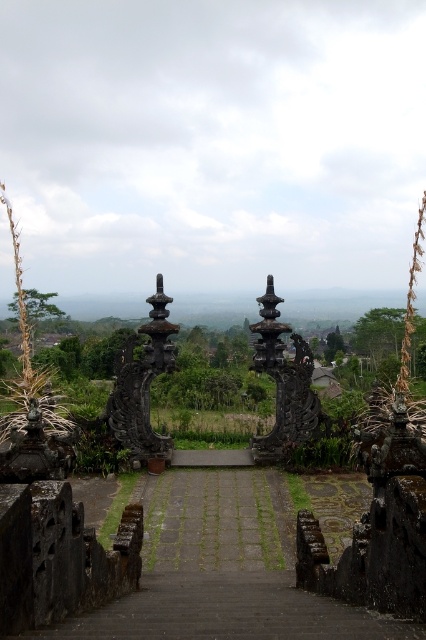
Is dark stone stairs at center thinner than black stone pillar at center?

No.

What do you see at coordinates (222, 570) in the screenshot?
I see `dark stone stairs at center` at bounding box center [222, 570].

Between point (241, 497) and point (307, 376), which one is positioned behind?

Point (307, 376)

Identify the location of dark stone stairs at center. The height and width of the screenshot is (640, 426). (222, 570).